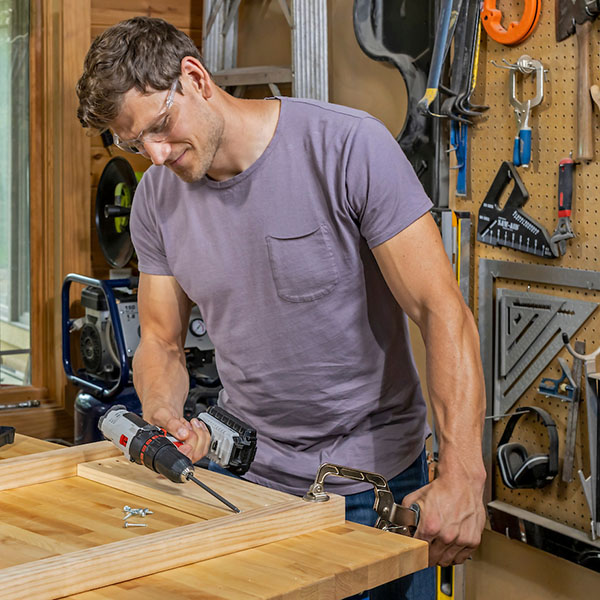
Identify the location of ladder. (315, 70).